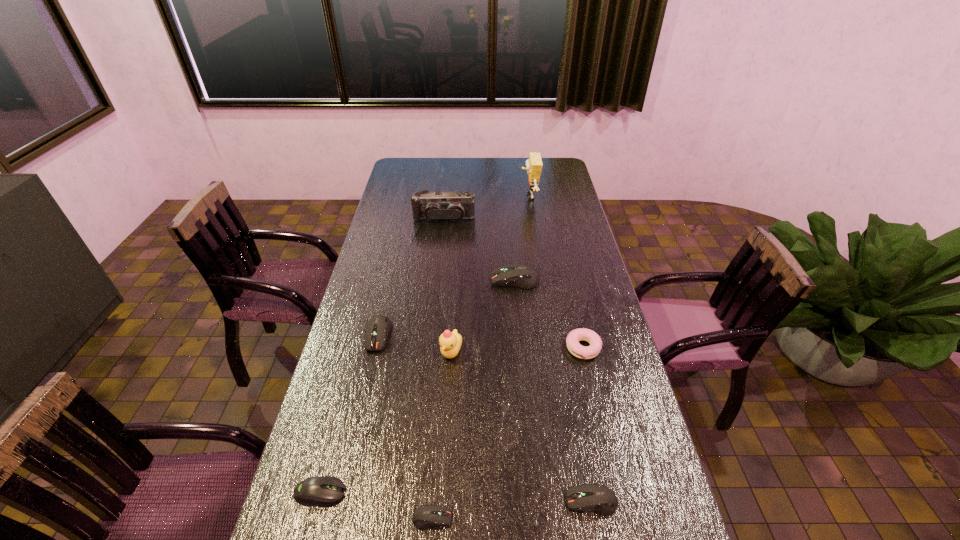
Identify the location of the tallest object. (534, 164).

Find the location of a particular element. the farthest object is located at coordinates (534, 164).

This screenshot has height=540, width=960. Identify the location of the eighth nearest object. (433, 206).

Locate an element on the screen. The height and width of the screenshot is (540, 960). camcorder is located at coordinates (433, 206).

Where is `duckling`? This screenshot has height=540, width=960. duckling is located at coordinates 450,342.

The width and height of the screenshot is (960, 540). I want to click on yellow duckling, so click(450, 342).

In order to click on the sixth shortest object in this screenshot , I will do `click(514, 275)`.

Where is `the farthest dark computer equipment`? Image resolution: width=960 pixels, height=540 pixels. the farthest dark computer equipment is located at coordinates (514, 275).

You are a GUI agent. You are given a task and a screenshot of the screen. Output one action in this format:
    pyautogui.click(x=<x>, y=<y>)
    Task: Click on the fourth nearest computer equipment
    The width and height of the screenshot is (960, 540).
    Given the screenshot: What is the action you would take?
    pyautogui.click(x=378, y=327)

Locate an element on the screen. the leftmost dark computer equipment is located at coordinates (378, 327).